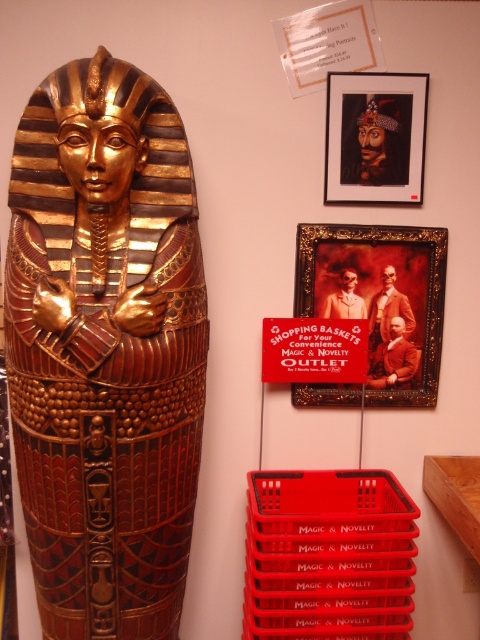
Is gold polished wood sarcophagus at left smaller than wooden framed picture at upper center?

Actually, gold polished wood sarcophagus at left might be larger than wooden framed picture at upper center.

Can you confirm if gold polished wood sarcophagus at left is positioned below wooden framed picture at upper center?

Yes, gold polished wood sarcophagus at left is below wooden framed picture at upper center.

Does point (19, 360) come closer to viewer compared to point (443, 296)?

Yes, it is.

Where is `gold polished wood sarcophagus at left`? The image size is (480, 640). gold polished wood sarcophagus at left is located at coordinates (105, 348).

Measure the distance between gold polished wood sarcophagus at left and matte black portrait at upper center.

28.78 inches

This screenshot has height=640, width=480. In order to click on gold polished wood sarcophagus at left in this screenshot , I will do `click(105, 348)`.

Is gold polished wood sarcophagus at left further to the viewer compared to red plastic crate at lower right?

No, it is not.

Between gold polished wood sarcophagus at left and red plastic crate at lower right, which one has more height?

With more height is gold polished wood sarcophagus at left.

Who is more distant from viewer, (144, 300) or (360, 522)?

Point (360, 522)

Locate an element on the screen. The width and height of the screenshot is (480, 640). gold polished wood sarcophagus at left is located at coordinates coord(105,348).